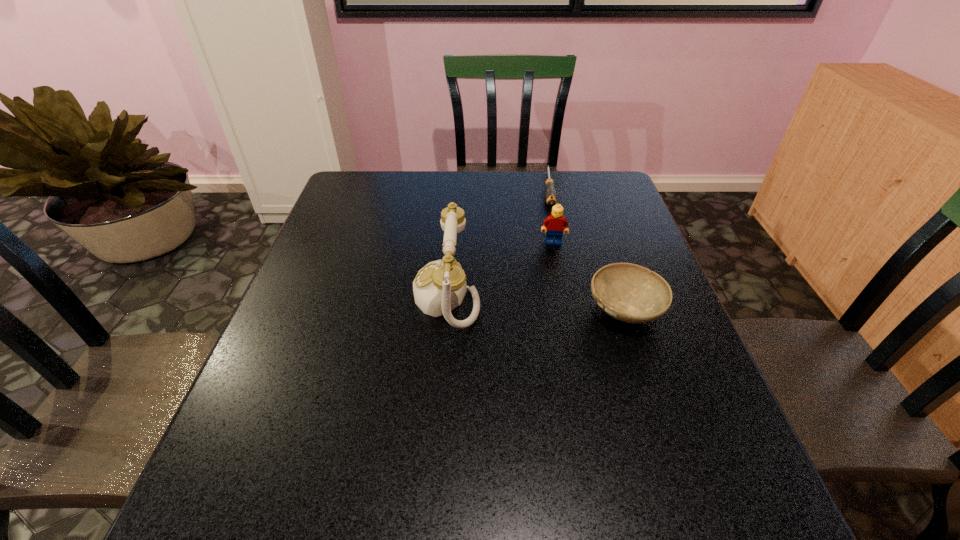
Find the location of `vacant space that's between the Lego and the second shortest object`. vacant space that's between the Lego and the second shortest object is located at coordinates (589, 275).

The image size is (960, 540). What are the coordinates of `empty location between the farthest object and the tallest object` in the screenshot? It's located at (497, 242).

At what (x,y) coordinates should I click in order to perform the action: click on free space between the screwdriver and the telephone. Please return your answer as a coordinate pair (x, y). Looking at the image, I should click on (497, 242).

Point out which object is positioned as the nearest to the second tallest object. Please provide its 2D coordinates. Your answer should be formatted as a tuple, i.e. [(x, y)], where the tuple contains the x and y coordinates of a point satisfying the conditions above.

[(550, 195)]

This screenshot has height=540, width=960. I want to click on the third closest object relative to the telephone, so click(x=550, y=195).

This screenshot has height=540, width=960. I want to click on free space that satisfies the following two spatial constraints: 1. on the back side of the screwdriver; 2. on the left side of the Lego, so click(x=542, y=188).